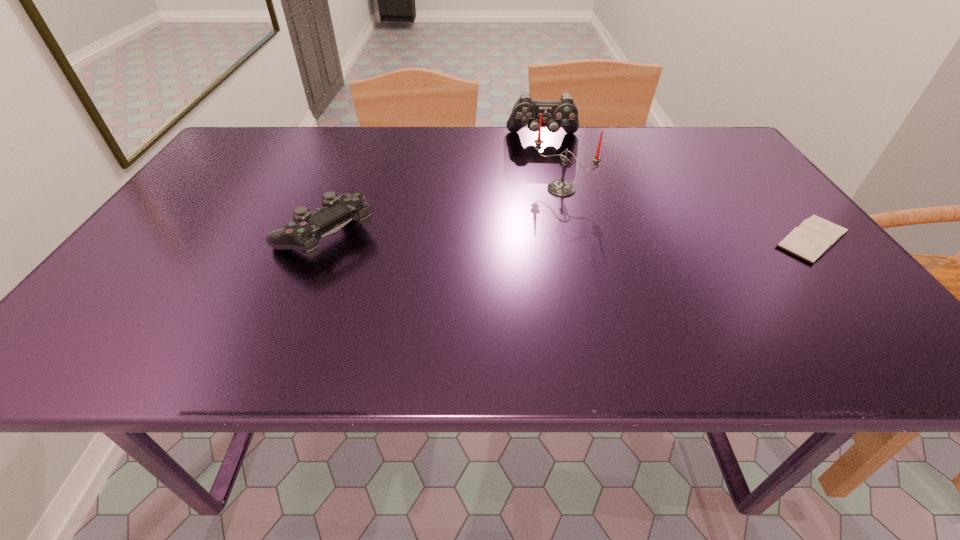
Locate an element on the screen. This screenshot has width=960, height=540. free space on the desktop that is between the left control and the shortest object and is positioned on the front-facing side of the third nearest object is located at coordinates (516, 237).

Where is `free space on the desktop that is between the nearer control and the diary and is positioned on the surface of the right control with buttons`? free space on the desktop that is between the nearer control and the diary and is positioned on the surface of the right control with buttons is located at coordinates (552, 237).